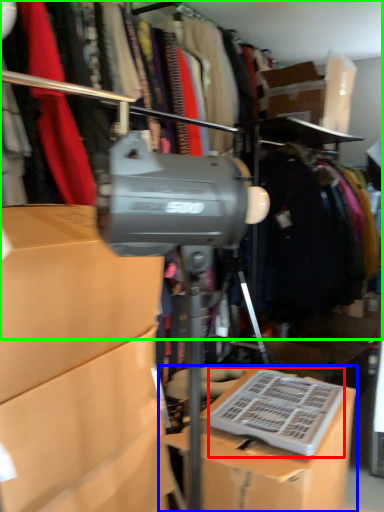
Question: Estimate the real-world distances between objects in this image. Which object is farther from wide (highlighted by a red box), box (highlighted by a blue box) or closet (highlighted by a green box)?

Choices:
 (A) box
 (B) closet

Answer: (B)